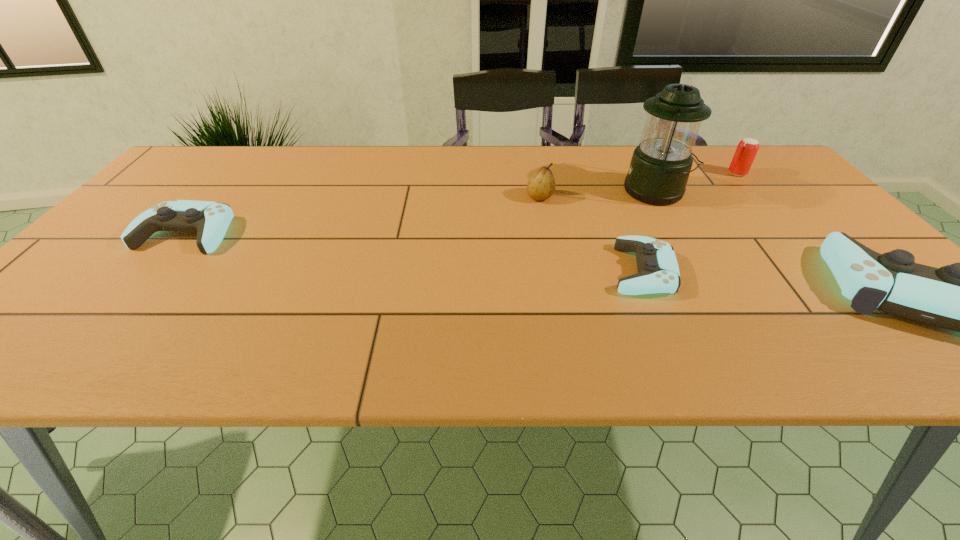
Find the location of `blank area at the left edge`. blank area at the left edge is located at coordinates (111, 278).

This screenshot has height=540, width=960. In the image, there is a desktop. In order to click on vacant space at the near left corner in this screenshot , I will do `click(105, 306)`.

At what (x,y) coordinates should I click in order to perform the action: click on vacant area at the far right corner of the desktop. Please return your answer as a coordinate pair (x, y). This screenshot has height=540, width=960. Looking at the image, I should click on click(759, 181).

Image resolution: width=960 pixels, height=540 pixels. Find the location of `blank region between the pear and the lantern`. blank region between the pear and the lantern is located at coordinates (598, 194).

Where is `blank region between the second control from right to left and the second shortest control`? blank region between the second control from right to left and the second shortest control is located at coordinates (415, 252).

This screenshot has height=540, width=960. I want to click on empty location between the beer can and the lantern, so click(x=697, y=183).

Where is `vacant region between the second shortest control and the beer can`? vacant region between the second shortest control and the beer can is located at coordinates (462, 203).

Locate an element on the screen. vacant region between the second control from right to left and the second shortest control is located at coordinates (415, 252).

You are a GUI agent. You are given a task and a screenshot of the screen. Output one action in this format:
    pyautogui.click(x=<x>, y=<y>)
    Task: Click on the vacant region between the lantern and the shortest control
    The image size is (960, 540).
    Given the screenshot: What is the action you would take?
    pyautogui.click(x=650, y=231)

Identify which object is located as the fifth nearest to the second control from right to left. Please provide its 2D coordinates. Your answer should be formatted as a tuple, i.e. [(x, y)], where the tuple contains the x and y coordinates of a point satisfying the conditions above.

[(210, 220)]